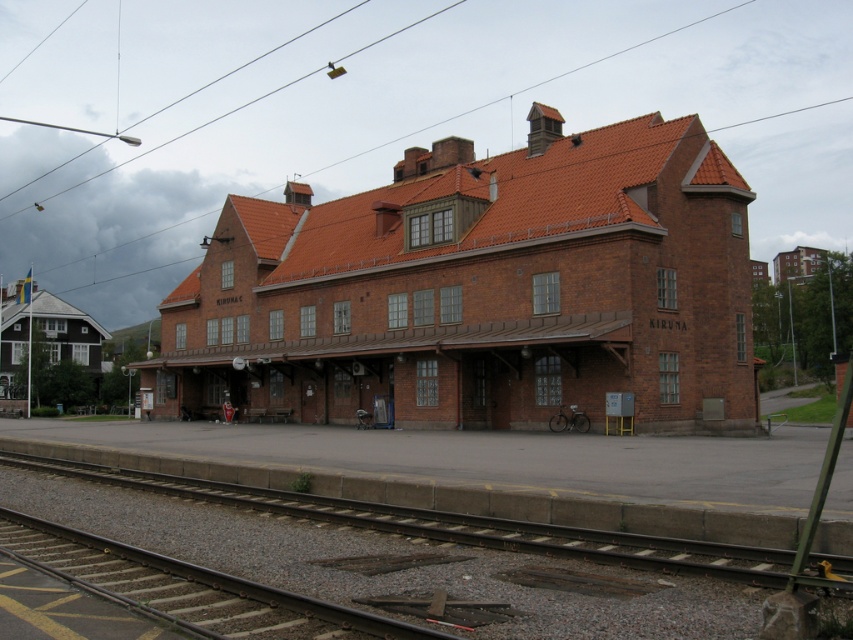
Question: Which of the following is the closest to the observer?

Choices:
 (A) brick building at center
 (B) smooth metal tracks at center
 (C) dark gray metal train track at lower left

Answer: (B)

Question: From the image, what is the correct spatial relationship of brick building at center in relation to smooth metal tracks at center?

Choices:
 (A) right
 (B) left

Answer: (B)

Question: Is smooth metal tracks at center bigger than dark gray metal train track at lower left?

Choices:
 (A) yes
 (B) no

Answer: (A)

Question: Which of the following is the farthest from the observer?

Choices:
 (A) brick building at center
 (B) dark gray metal train track at lower left

Answer: (A)

Question: Which of the following is the farthest from the observer?

Choices:
 (A) dark gray metal train track at lower left
 (B) brick building at center

Answer: (B)

Question: Can you confirm if brick building at center is positioned below dark gray metal train track at lower left?

Choices:
 (A) yes
 (B) no

Answer: (B)